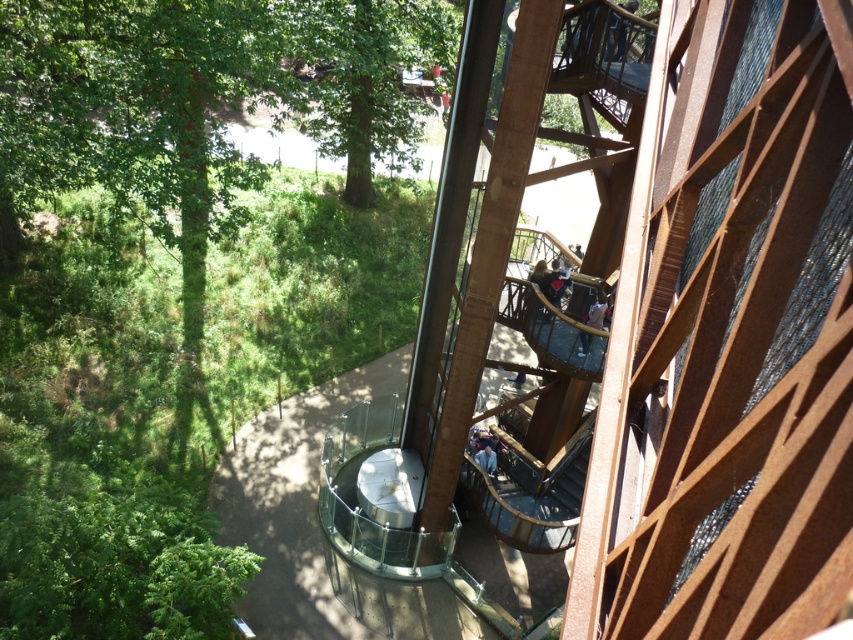
Question: Where is green leafy tree at left located in relation to green leafy tree at upper left in the image?

Choices:
 (A) left
 (B) right

Answer: (A)

Question: Among these objects, which one is farthest from the camera?

Choices:
 (A) green leafy tree at left
 (B) green leafy tree at upper left

Answer: (B)

Question: Is green leafy tree at left wider than green leafy tree at upper left?

Choices:
 (A) no
 (B) yes

Answer: (B)

Question: Among these objects, which one is farthest from the camera?

Choices:
 (A) green leafy tree at left
 (B) green leafy tree at upper left

Answer: (B)

Question: Does green leafy tree at left appear on the right side of green leafy tree at upper left?

Choices:
 (A) yes
 (B) no

Answer: (B)